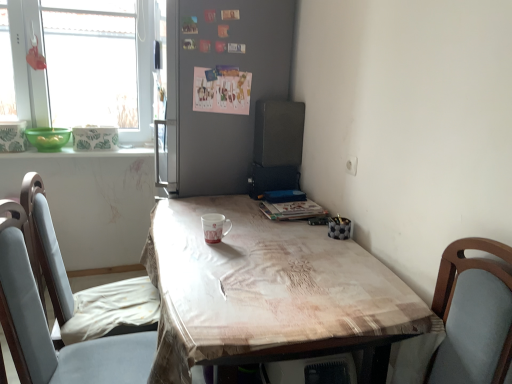
Identify the location of vacant space to the left of white glossy mug at center. (176, 240).